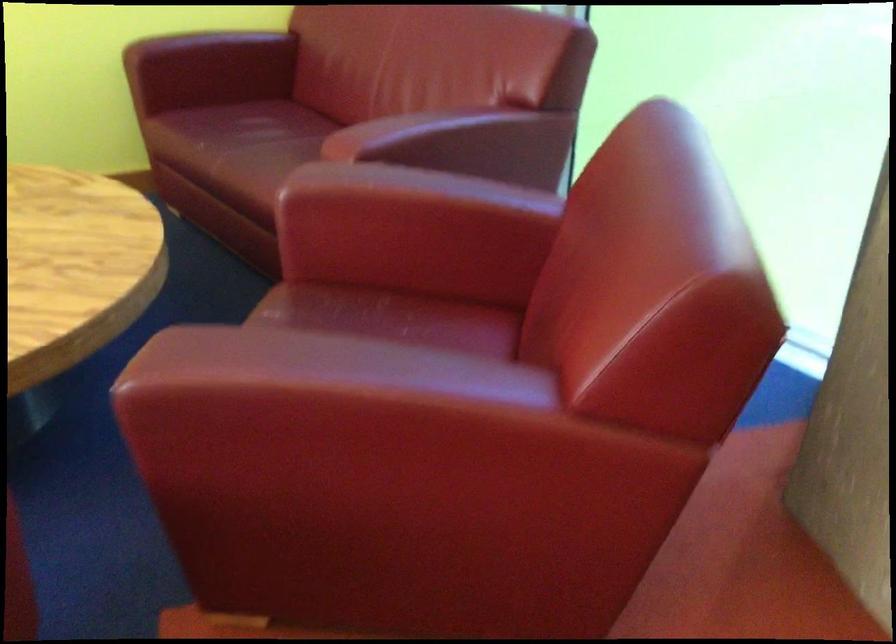
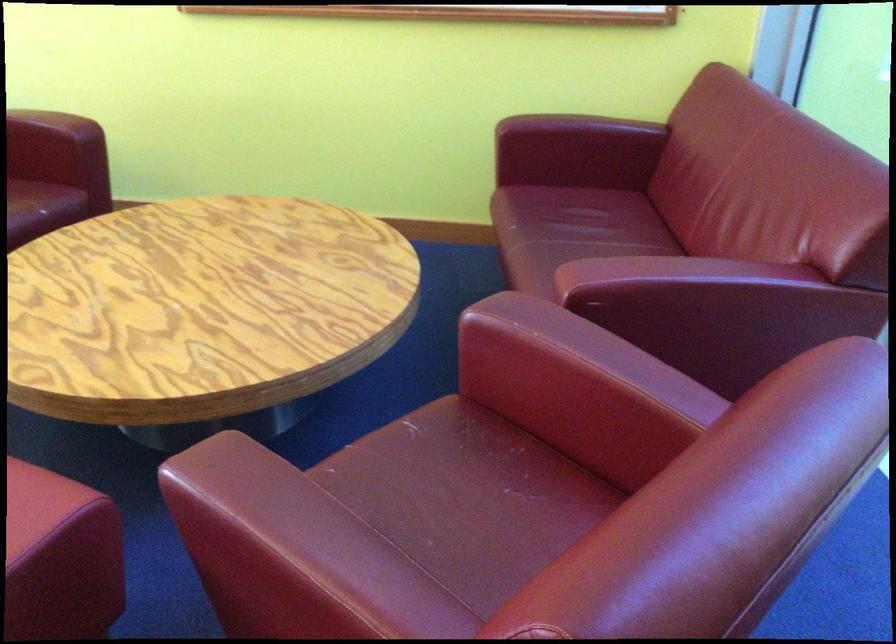
Find the pixel in the second image that matches [321,395] in the first image.

(261, 542)